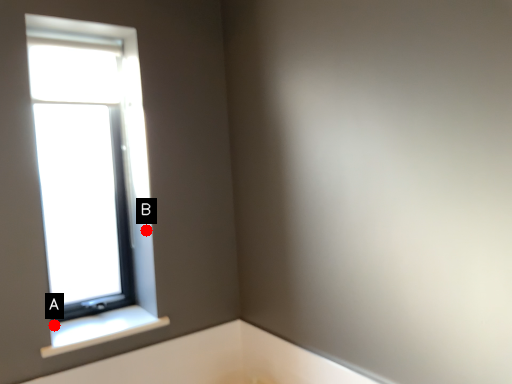
Question: Two points are circled on the image, labeled by A and B beside each circle. Which point is further to the camera?

Choices:
 (A) A is further
 (B) B is further

Answer: (A)